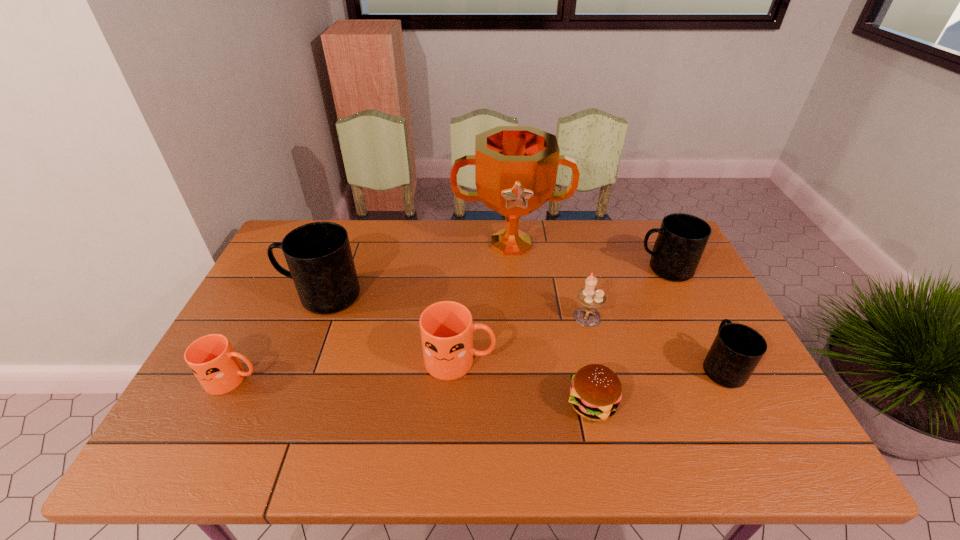
In the image, there is a desktop. Where is `vacant space at the right edge`? Image resolution: width=960 pixels, height=540 pixels. vacant space at the right edge is located at coordinates (715, 410).

The width and height of the screenshot is (960, 540). What are the coordinates of `vacant space at the far right corner of the desktop` in the screenshot? It's located at (647, 230).

The height and width of the screenshot is (540, 960). In order to click on empty location between the bigger orange mug and the award in this screenshot , I will do `click(486, 302)`.

Locate an element on the screen. vacant region between the smaller orange mug and the candle holder is located at coordinates (410, 348).

Locate an element on the screen. empty space that is in between the right orange mug and the candle holder is located at coordinates (523, 339).

The image size is (960, 540). Identify the location of free spot between the hamburger and the nearest black mug. click(x=657, y=386).

You are a GUI agent. You are given a task and a screenshot of the screen. Output one action in this format:
    pyautogui.click(x=<x>, y=<y>)
    Task: Click on the empty space between the smaller orange mug and the leftmost black mug
    The width and height of the screenshot is (960, 540).
    Given the screenshot: What is the action you would take?
    pyautogui.click(x=277, y=338)

Locate an element on the screen. Image resolution: width=960 pixels, height=540 pixels. empty location between the candle holder and the smaller orange mug is located at coordinates (410, 348).

Find the location of a particular element. This screenshot has width=960, height=540. free spot between the right orange mug and the brown hamburger is located at coordinates (526, 382).

Select which object is the second closest to the second smallest black mug. Please provide its 2D coordinates. Your answer should be formatted as a tuple, i.e. [(x, y)], where the tuple contains the x and y coordinates of a point satisfying the conditions above.

[(516, 167)]